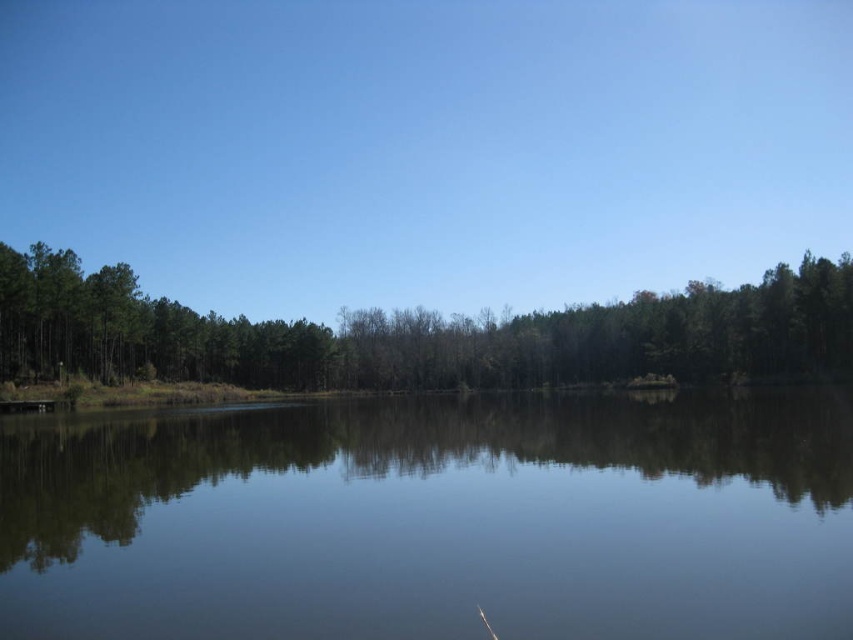
Does clear water at center have a lesser height compared to green matte trees at center?

Correct, clear water at center is not as tall as green matte trees at center.

Which is more to the left, clear water at center or green matte trees at center?

From the viewer's perspective, clear water at center appears more on the left side.

Is point (637, 429) closer to camera compared to point (64, 356)?

Yes, it is.

I want to click on clear water at center, so click(x=434, y=518).